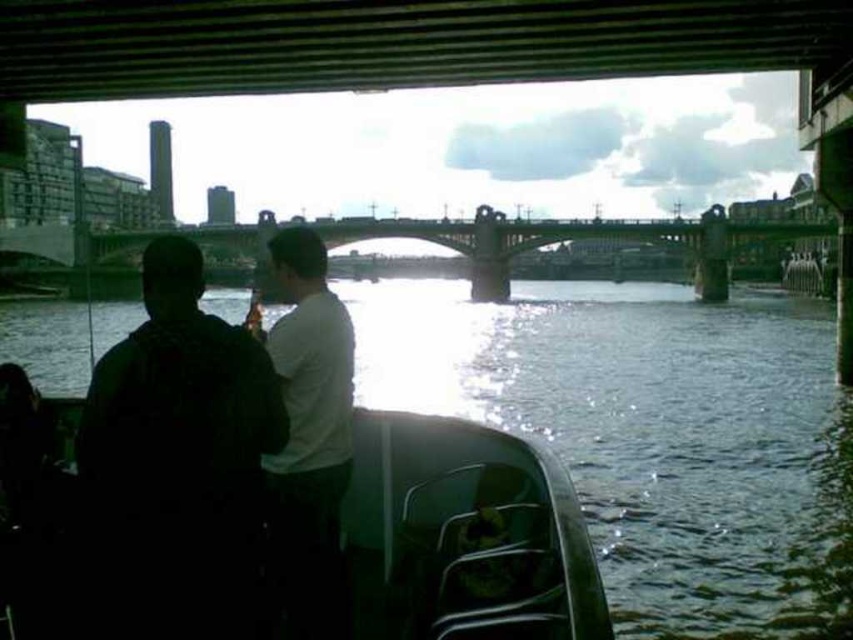
Is greenish water at lower center below white matte shirt at center?

Correct, greenish water at lower center is located below white matte shirt at center.

Does greenish water at lower center have a greater height compared to white matte shirt at center?

In fact, greenish water at lower center may be shorter than white matte shirt at center.

Does point (741, 372) lie behind point (316, 356)?

Yes.

Image resolution: width=853 pixels, height=640 pixels. In order to click on greenish water at lower center in this screenshot , I will do `click(624, 404)`.

Does greenish water at lower center appear on the right side of dark fabric shirt at left?

Indeed, greenish water at lower center is positioned on the right side of dark fabric shirt at left.

Who is lower down, greenish water at lower center or dark fabric shirt at left?

Positioned lower is dark fabric shirt at left.

The height and width of the screenshot is (640, 853). Find the location of `greenish water at lower center`. greenish water at lower center is located at coordinates (624, 404).

Is white matte shirt at center behind concrete bridge at center?

No, white matte shirt at center is closer to the viewer.

Is white matte shirt at center positioned in front of concrete bridge at center?

Yes, it is.

Between point (318, 292) and point (125, 291), which one is positioned in front?

Point (318, 292) is more forward.

Locate an element on the screen. The image size is (853, 640). white matte shirt at center is located at coordinates (308, 436).